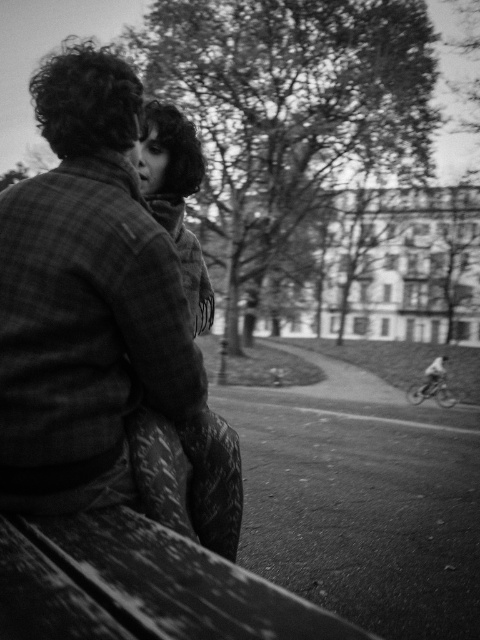
Based on the photo, can you confirm if plaid wool coat at center is smaller than fluffy scarf at center?

Yes.

Who is more distant from viewer, (85,294) or (130,442)?

Point (130,442)

I want to click on plaid wool coat at center, so click(99, 316).

Who is lower down, fluffy scarf at center or soft wool scarf at center?

fluffy scarf at center is below.

Which of these two, fluffy scarf at center or soft wool scarf at center, stands taller?

With more height is soft wool scarf at center.

Does point (168, 189) come closer to viewer compared to point (178, 156)?

Yes.

Image resolution: width=480 pixels, height=640 pixels. In order to click on fluffy scarf at center in this screenshot , I will do pos(190,477).

Is plaid wool coat at center above soft wool scarf at center?

Correct, plaid wool coat at center is located above soft wool scarf at center.

Between plaid wool coat at center and soft wool scarf at center, which one appears on the right side from the viewer's perspective?

From the viewer's perspective, soft wool scarf at center appears more on the right side.

At what (x,y) coordinates should I click in order to perform the action: click on plaid wool coat at center. Please return your answer as a coordinate pair (x, y). Image resolution: width=480 pixels, height=640 pixels. Looking at the image, I should click on (99, 316).